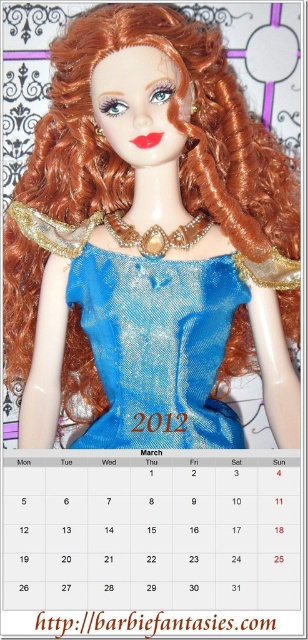
Who is higher up, shiny blue dress at center or blue sequined dress at center?

shiny blue dress at center is above.

Which is more to the right, shiny blue dress at center or blue sequined dress at center?

blue sequined dress at center is more to the right.

The height and width of the screenshot is (640, 308). What do you see at coordinates (149, 243) in the screenshot?
I see `shiny blue dress at center` at bounding box center [149, 243].

You are a GUI agent. You are given a task and a screenshot of the screen. Output one action in this format:
    pyautogui.click(x=<x>, y=<y>)
    Task: Click on the shiny blue dress at center
    This screenshot has width=308, height=640.
    Given the screenshot: What is the action you would take?
    pyautogui.click(x=149, y=243)